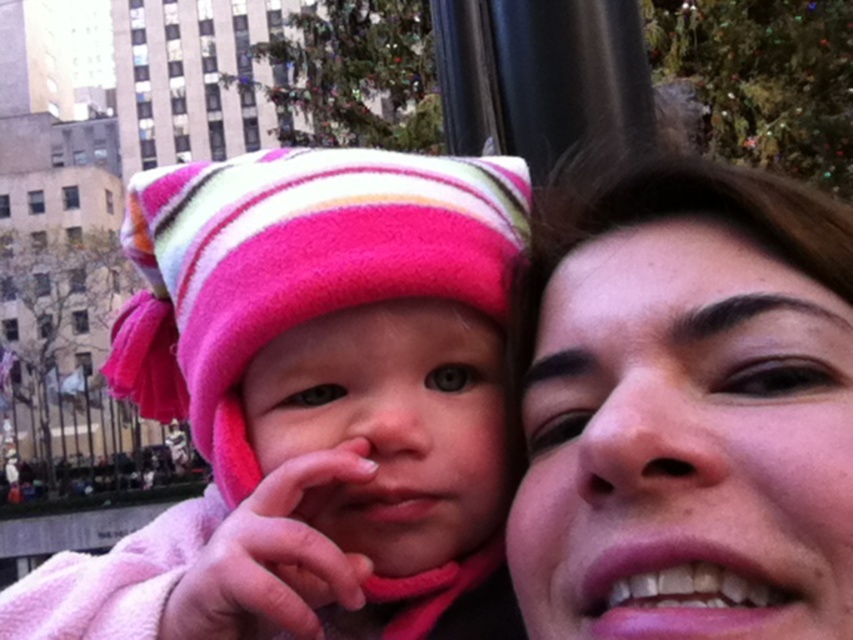
You are a photographer trying to capture a portrait of the matte fleece hat at left and the smooth skin face at right. Since you want to ensure both subjects are in focus, you need to know which one is bigger. Which object is larger?

The matte fleece hat at left is larger than the smooth skin face at right according to the description.

You are a photographer trying to capture a clear photo of both the matte fleece hat at left and the smooth skin face at right. Since you want both objects to be in focus, which one should you adjust your camera focus on first?

You should focus on the matte fleece hat at left first because it is closer to the viewer than the smooth skin face at right. By focusing on the closer object, the farther one may still be within the depth of field, ensuring both are in focus.